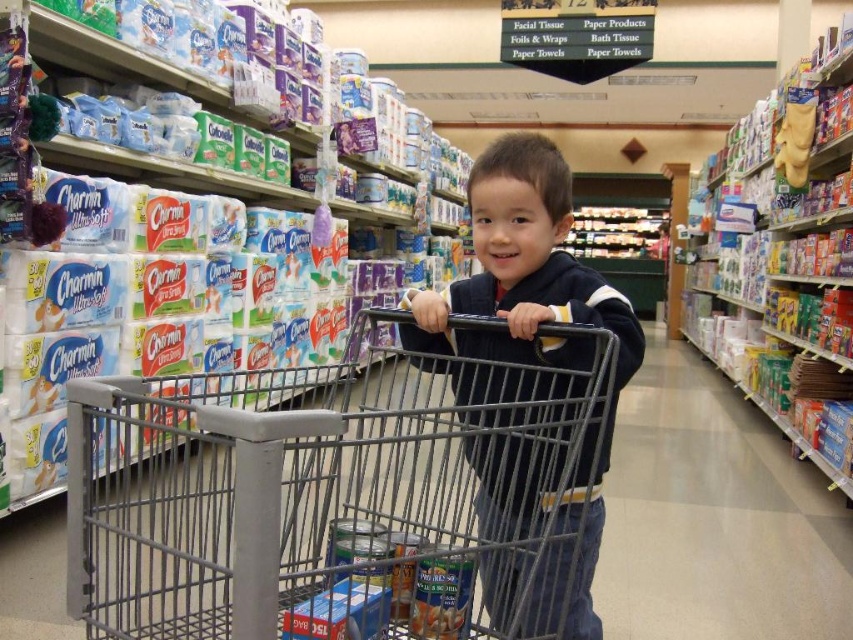
The child is holding the metallic gray shopping cart at center and wearing the dark blue sweater at center. Which item is bigger in size?

The metallic gray shopping cart at center is larger in size compared to the dark blue sweater at center.

The child is holding the metallic gray shopping cart at center and wearing the dark blue sweater at center. Which item is lower in position?

The metallic gray shopping cart at center is located below dark blue sweater at center, so the shopping cart is lower than the sweater.

Based on the scene description, where is the metallic gray shopping cart at center positioned in terms of coordinates?

The metallic gray shopping cart at center is located at point (x=332, y=492).